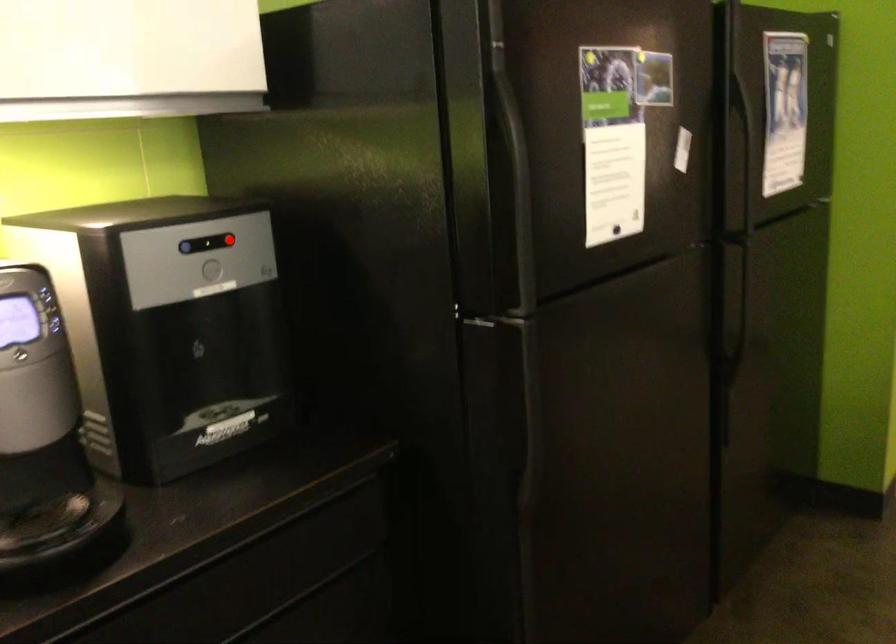
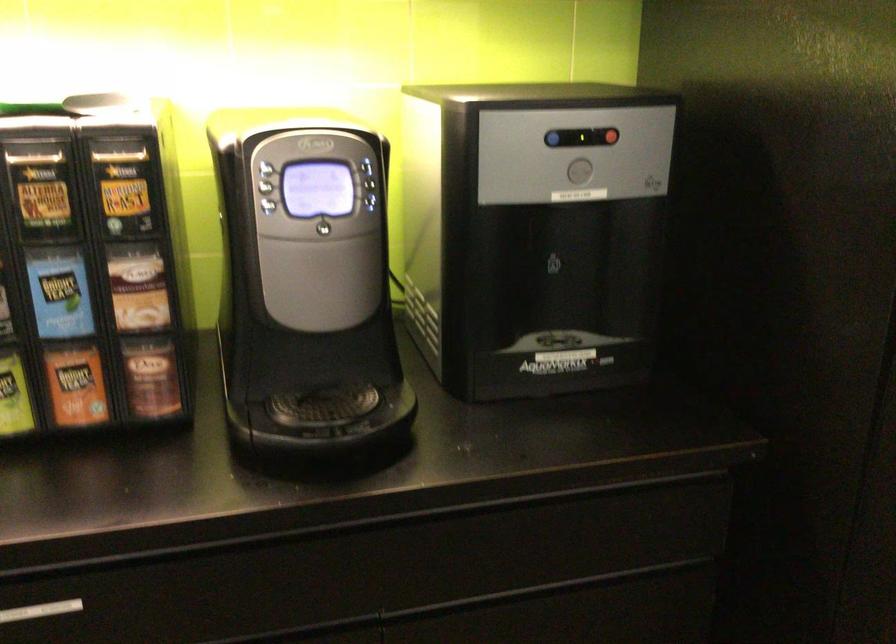
Question: I am providing you with two images of the same scene from different viewpoints. In image1, a red point is highlighted. Considering the same 3D point in image2, which of the following is correct?

Choices:
 (A) It is closer
 (B) It is farther

Answer: (A)